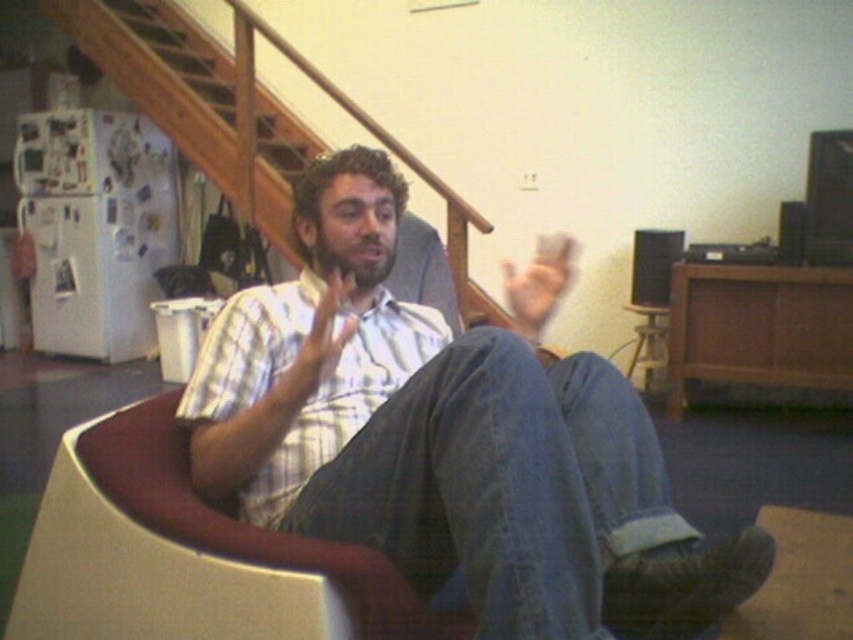
Between plaid shirt at center and white plastic swivel chair at center, which one has more height?

plaid shirt at center

Between point (508, 604) and point (230, 609), which one is positioned in front?

Positioned in front is point (508, 604).

Find the location of `plaid shirt at center`. plaid shirt at center is located at coordinates (450, 436).